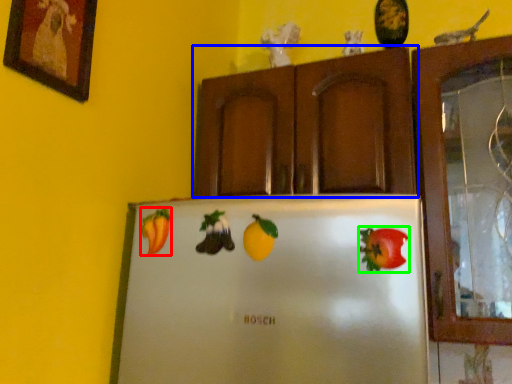
Question: Which is nearer to the fruit (highlighted by a red box)? cabinetry (highlighted by a blue box) or fruit (highlighted by a green box).

Choices:
 (A) cabinetry
 (B) fruit

Answer: (B)